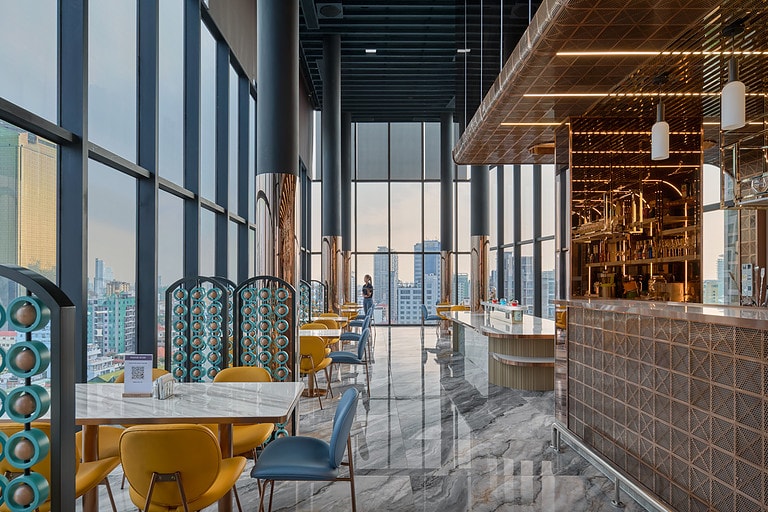
Locate an element on the screen. The width and height of the screenshot is (768, 512). pillars is located at coordinates (277, 129), (329, 166), (346, 192), (445, 203), (481, 205).